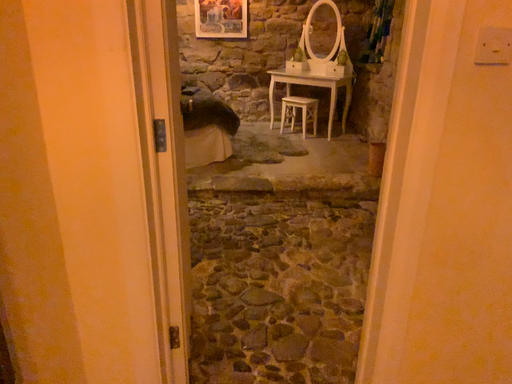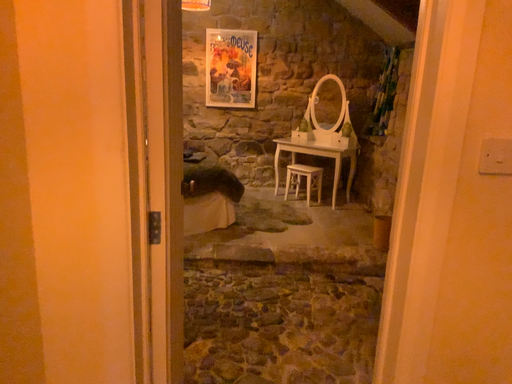
Question: Which way did the camera rotate in the video?

Choices:
 (A) rotated upward
 (B) rotated downward

Answer: (A)